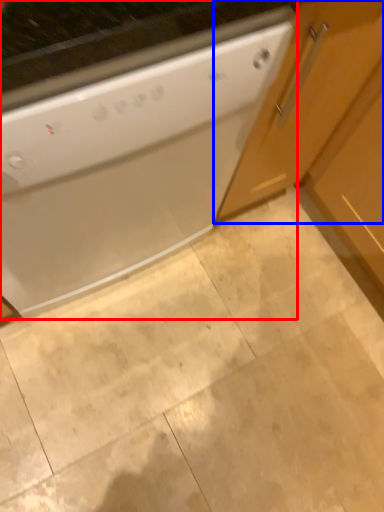
Question: Which object is further to the camera taking this photo, home appliance (highlighted by a red box) or cabinetry (highlighted by a blue box)?

Choices:
 (A) home appliance
 (B) cabinetry

Answer: (B)